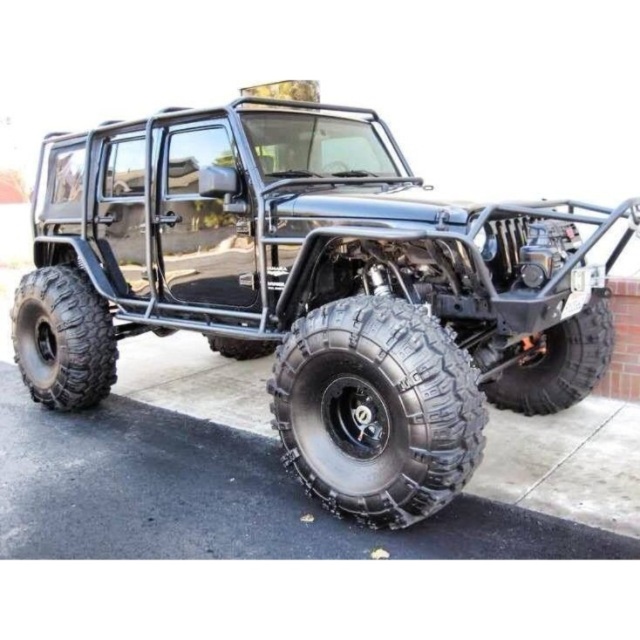
Question: Observing the image, what is the correct spatial positioning of black rugged tire at left in reference to black rubber tire at center?

Choices:
 (A) below
 (B) above

Answer: (A)

Question: Does black rugged tire at lower center appear over black rugged tire at lower right?

Choices:
 (A) yes
 (B) no

Answer: (B)

Question: Is black matte/texture jeep at center above black rugged tire at lower center?

Choices:
 (A) no
 (B) yes

Answer: (B)

Question: Which object appears closest to the camera in this image?

Choices:
 (A) black rubber tire at center
 (B) black rugged tire at left
 (C) black rugged tire at lower right

Answer: (C)

Question: Which point is farther to the camera?

Choices:
 (A) black matte/texture jeep at center
 (B) black rugged tire at lower right

Answer: (B)

Question: Estimate the real-world distances between objects in this image. Which object is closer to the black rubber tire at center?

Choices:
 (A) black matte/texture jeep at center
 (B) black rugged tire at lower right
 (C) black rugged tire at lower center

Answer: (A)